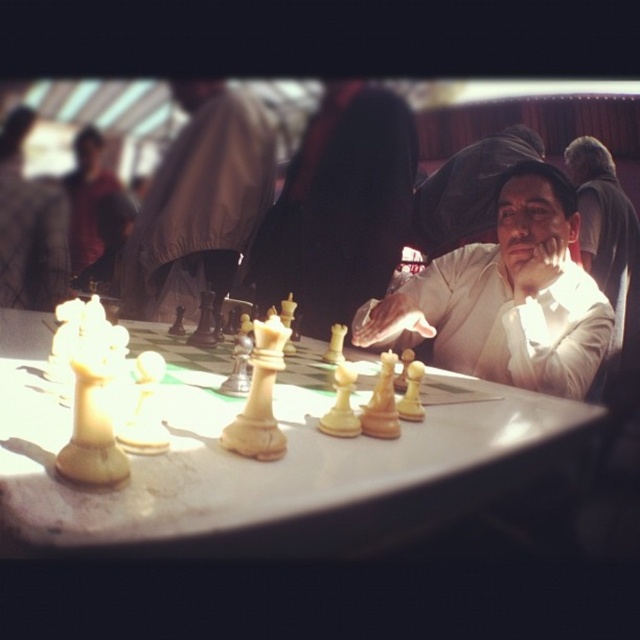
Question: Is matte white chess piece at left closer to the viewer compared to white glossy chess piece at center?

Choices:
 (A) yes
 (B) no

Answer: (B)

Question: Among these points, which one is farthest from the camera?

Choices:
 (A) (500, 420)
 (B) (625, 300)

Answer: (B)

Question: Based on their relative distances, which object is nearer to the white glossy chess pieces at center?

Choices:
 (A) matte white chess piece at left
 (B) matte black chess piece at center

Answer: (B)

Question: Among these objects, which one is farthest from the camera?

Choices:
 (A) matte white chess piece at left
 (B) white glossy chess piece at center
 (C) white glossy chessboard at center
 (D) white glossy chess pieces at center

Answer: (A)

Question: Does white glossy chess pieces at center appear under matte black chess piece at center?

Choices:
 (A) no
 (B) yes

Answer: (B)

Question: Can you confirm if matte white chess piece at left is positioned below white glossy chess piece at center?

Choices:
 (A) yes
 (B) no

Answer: (B)